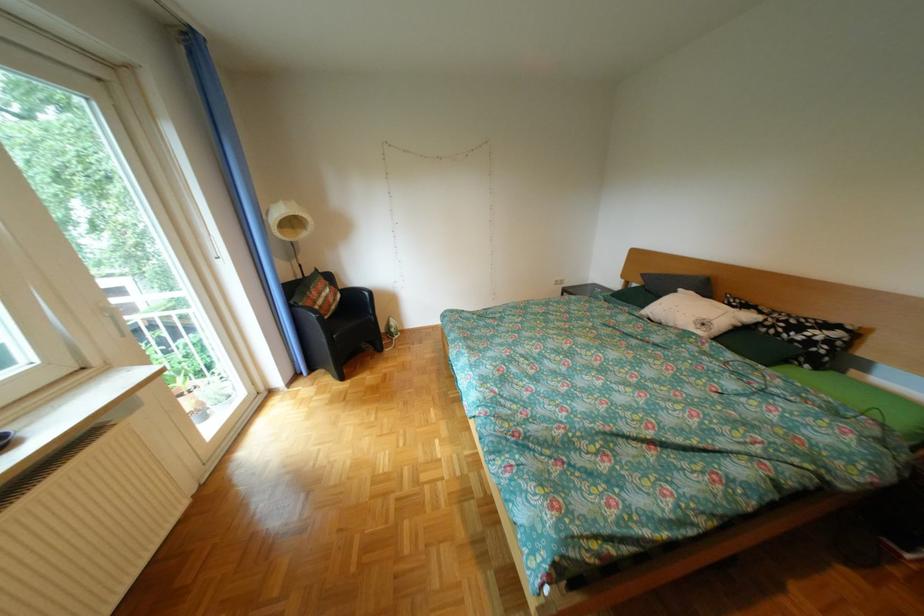
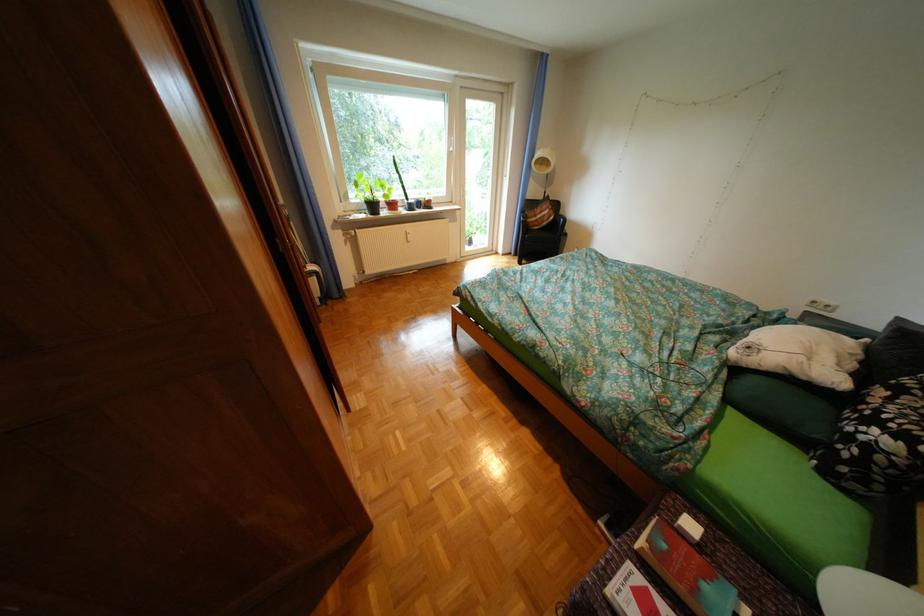
The point at (775, 313) is marked in the first image. Where is the corresponding point in the second image?

(904, 399)